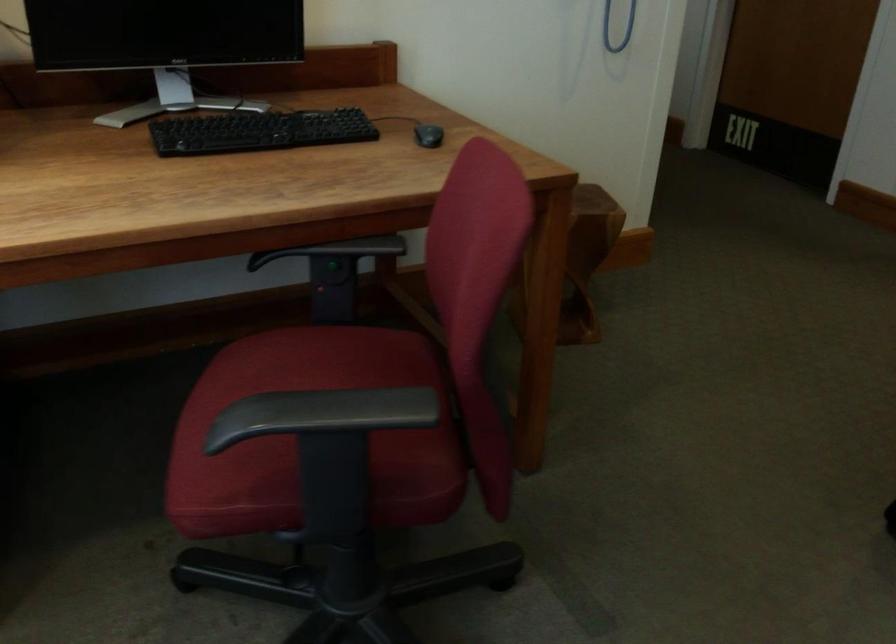
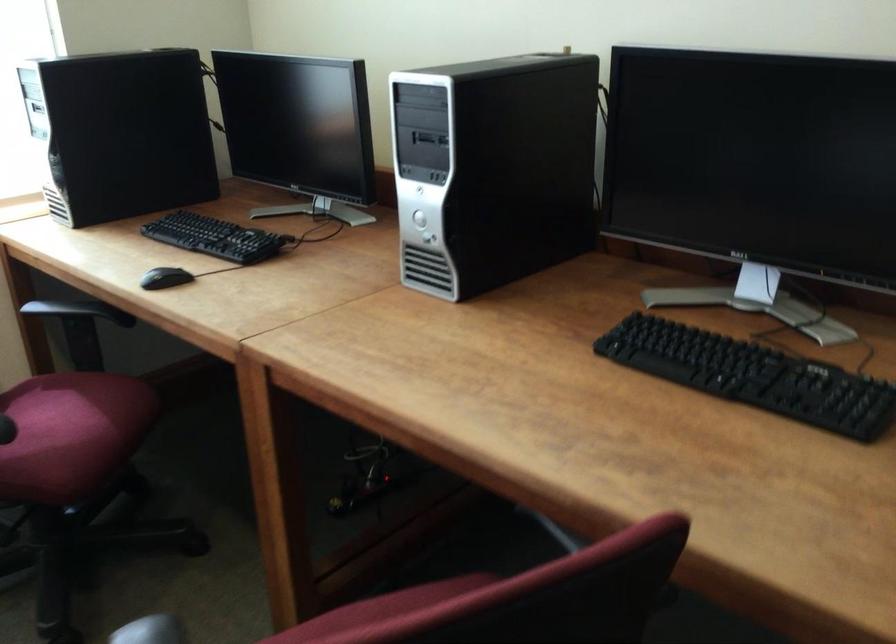
In the second image, find the point that corresponds to the point at 283,128 in the first image.

(753, 375)